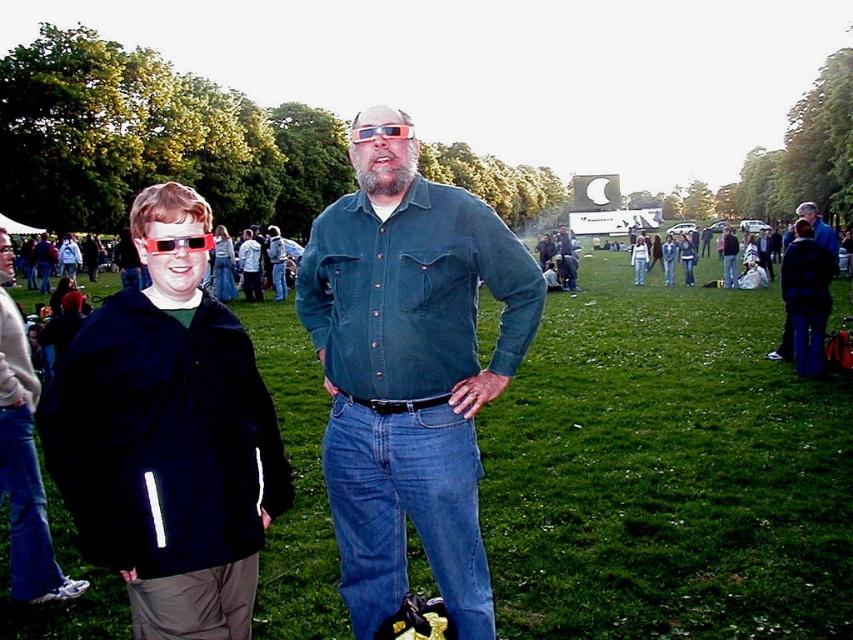
Question: Which point is farther to the camera?

Choices:
 (A) (602, 593)
 (B) (180, 236)
 (C) (219, 528)

Answer: (A)

Question: Is denim shirt at center bigger than matte plastic sunglasses at center?

Choices:
 (A) yes
 (B) no

Answer: (A)

Question: Can you confirm if green grass at center is bigger than denim shirt at center?

Choices:
 (A) no
 (B) yes

Answer: (B)

Question: Which of these objects is positioned farthest from the green grass at center?

Choices:
 (A) matte plastic sunglasses at center
 (B) denim shirt at center

Answer: (A)

Question: Based on their relative distances, which object is farther from the matte plastic sunglasses at center?

Choices:
 (A) denim shirt at center
 (B) black fleece jacket at left

Answer: (A)

Question: Does denim shirt at center have a smaller size compared to matte plastic sunglasses at center?

Choices:
 (A) no
 (B) yes

Answer: (A)